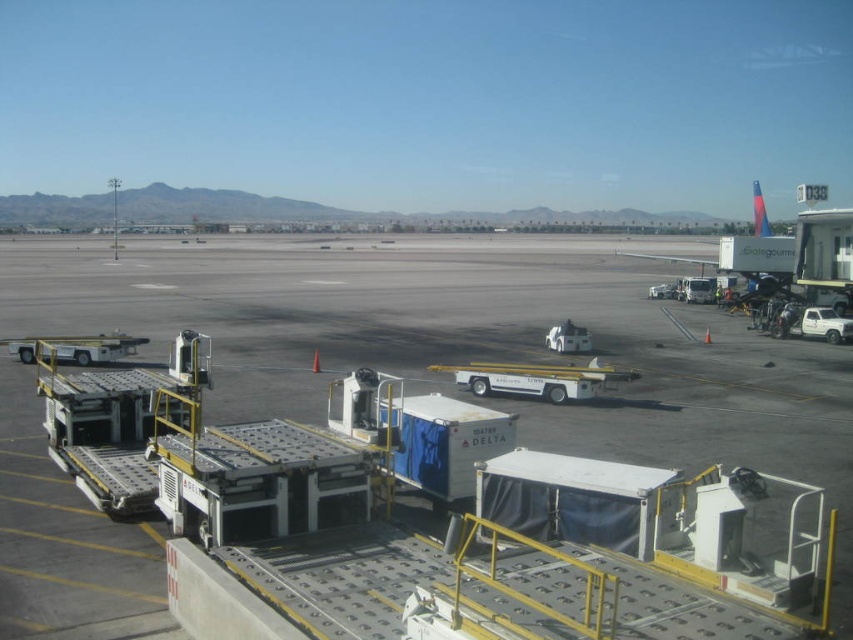
In the scene shown: You are standing at the point with coordinates point (759,198) and want to walk towards the point with coordinates point (664,314). Which direction should you face to walk straight towards it?

You should face towards the direction where point (664,314) is located, which is in front of point (759,198).

Based on the photo, you are a maintenance worker on the airport tarmac. You need to determine if the metallic gray tarmac at center is lower than the matte blue airplane at right. Based on the scene, can you confirm this?

Yes, the metallic gray tarmac at center has a lesser height compared to the matte blue airplane at right, so it is lower.

You are a ground crew member who needs to park a new cargo truck that is 12 meters long. You have two options for parking spots on the tarmac. One is the metallic gray tarmac at center and the other is near the matte blue airplane at right. Which parking spot has enough space to accommodate the truck without overlapping any other vehicles?

The metallic gray tarmac at center has a larger width than the matte blue airplane at right, so it is more likely to have enough space to accommodate the 12 meters long cargo truck without overlapping other vehicles.